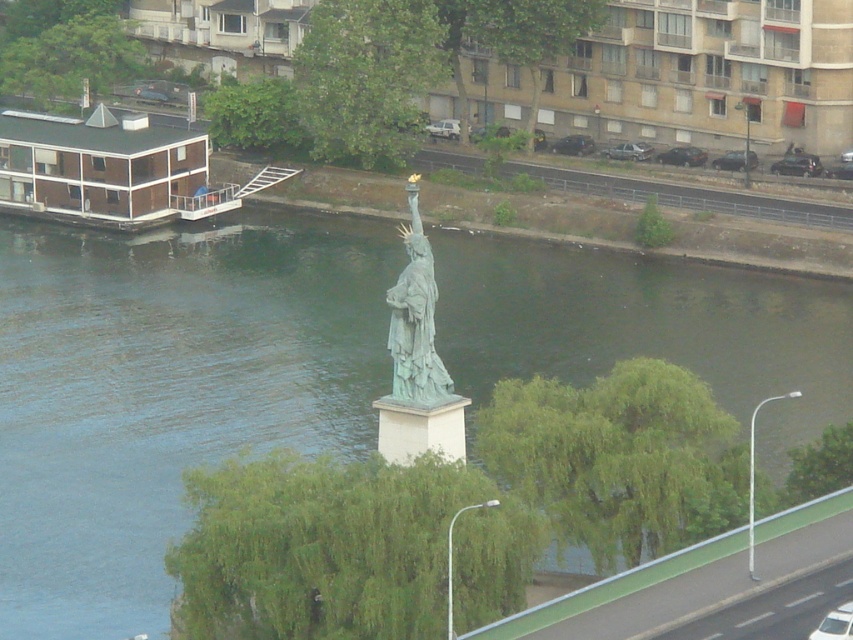
Consider the image. You are standing on the road parallel to the water and want to take a photo of the green patina statue at center and the greenish water at center. Which object should you frame first in your camera to ensure both are in the shot?

The green patina statue at center should be framed first since the greenish water at center is positioned to its right, so by centering the statue, the water will naturally be included in the frame to its right.

You are standing at the edge of the road near the parked vehicles. You want to reach the greenish water at center. Which direction should you walk to get there?

You should walk towards the water towards the center of the image to reach the greenish water at center.

From the picture: You are standing at the point closer to you in the scene. Which point are you at, point (558, 250) or point (397, 339)?

You are at point (558, 250) because it is closer to the viewer compared to point (397, 339).